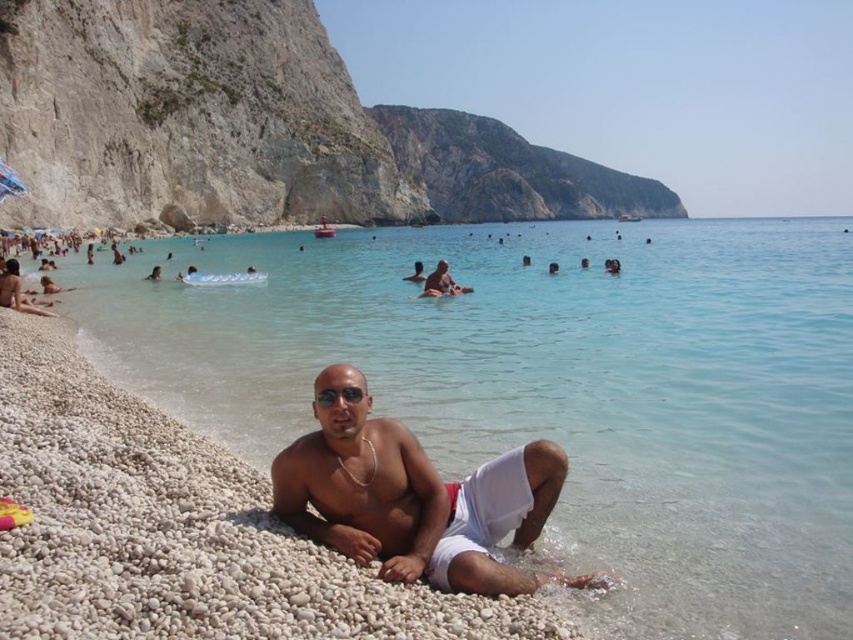
Question: Can you confirm if white cotton shorts at lower center is positioned above black reflective sunglasses at center?

Choices:
 (A) no
 (B) yes

Answer: (A)

Question: Which object is positioned farthest from the white cotton shorts at lower center?

Choices:
 (A) clear blue water at center
 (B) black reflective sunglasses at center

Answer: (A)

Question: Which point appears farthest from the camera in this image?

Choices:
 (A) (332, 397)
 (B) (425, 333)
 (C) (303, 506)

Answer: (B)

Question: Does clear blue water at center appear on the right side of white cotton shorts at lower center?

Choices:
 (A) yes
 (B) no

Answer: (A)

Question: From the image, what is the correct spatial relationship of clear blue water at center in relation to black reflective sunglasses at center?

Choices:
 (A) below
 (B) above

Answer: (B)

Question: Which object is farther from the camera taking this photo?

Choices:
 (A) black reflective sunglasses at center
 (B) clear blue water at center
 (C) white cotton shorts at lower center

Answer: (A)